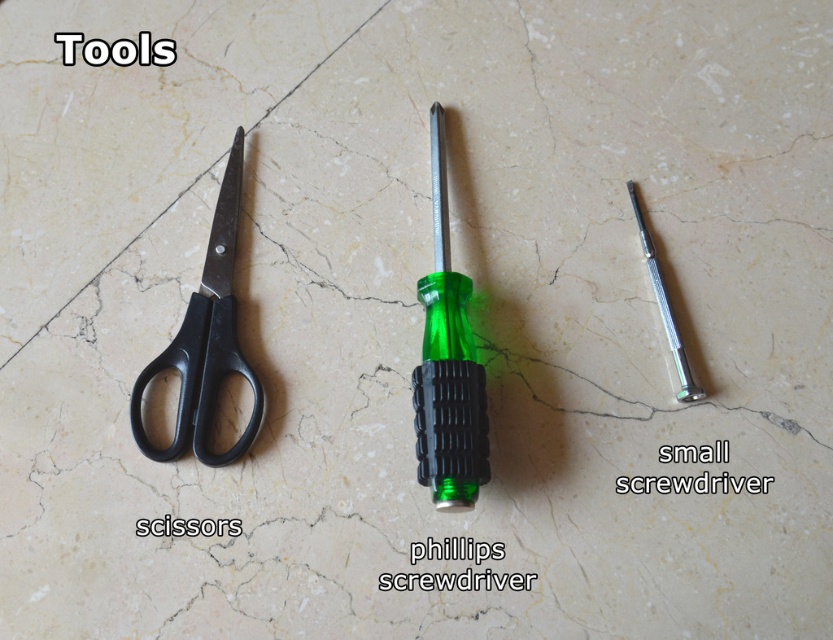
From the picture: What are the exact coordinates of the green plastic screwdriver at center?

The green plastic screwdriver at center is located at coordinates point (447, 364).

You are organizing tools on a marble countertop. You have the black plastic scissors at left and the metallic silver handle at center. Which tool takes up more vertical space on the countertop?

The black plastic scissors at left is much taller than the metallic silver handle at center, so it takes up more vertical space on the countertop.

You are organizing tools on a marble countertop and need to place the green plastic screwdriver at center and the black plastic scissors at left into a drawer that can only fit items smaller than the scissors. Will both fit?

The green plastic screwdriver at center is smaller than the black plastic scissors at left, so the screwdriver will fit in the drawer, but the scissors may not. However, since the question specifies placing both, only the screwdriver meets the size requirement.